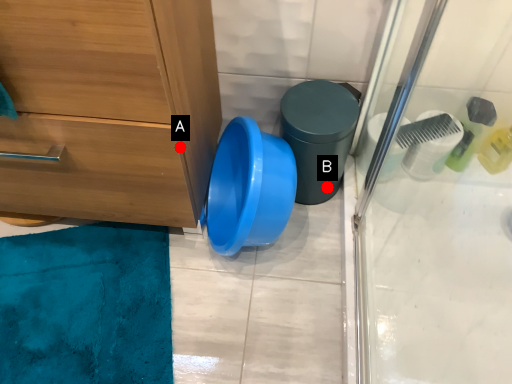
Question: Two points are circled on the image, labeled by A and B beside each circle. Which of the following is the farthest from the observer?

Choices:
 (A) A is further
 (B) B is further

Answer: (B)